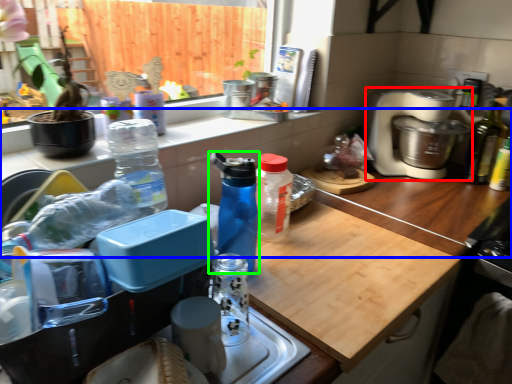
Question: Based on their relative distances, which object is farther from home appliance (highlighted by a red box)? Choose from countertop (highlighted by a blue box) and bottle (highlighted by a green box).

Choices:
 (A) countertop
 (B) bottle

Answer: (B)